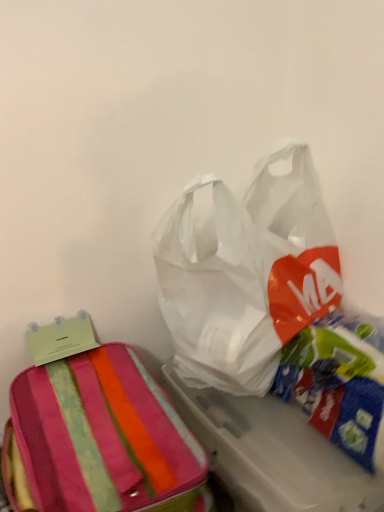
Question: Is transparent plastic bag at upper right looking in the opposite direction of striped fabric suitcase at left?

Choices:
 (A) yes
 (B) no

Answer: (B)

Question: Can you confirm if transparent plastic bag at upper right is wider than striped fabric suitcase at left?

Choices:
 (A) yes
 (B) no

Answer: (B)

Question: From the image's perspective, would you say transparent plastic bag at upper right is shown under striped fabric suitcase at left?

Choices:
 (A) yes
 (B) no

Answer: (B)

Question: From a real-world perspective, is transparent plastic bag at upper right physically below striped fabric suitcase at left?

Choices:
 (A) no
 (B) yes

Answer: (A)

Question: From the image's perspective, is transparent plastic bag at upper right on top of striped fabric suitcase at left?

Choices:
 (A) yes
 (B) no

Answer: (A)

Question: Does transparent plastic bag at upper right have a smaller size compared to striped fabric suitcase at left?

Choices:
 (A) no
 (B) yes

Answer: (A)

Question: From a real-world perspective, does striped fabric suitcase at left stand above transparent plastic bag at upper right?

Choices:
 (A) yes
 (B) no

Answer: (B)

Question: Is striped fabric suitcase at left taller than transparent plastic bag at upper right?

Choices:
 (A) no
 (B) yes

Answer: (A)

Question: Is the depth of striped fabric suitcase at left less than that of transparent plastic bag at upper right?

Choices:
 (A) no
 (B) yes

Answer: (B)

Question: Can you confirm if striped fabric suitcase at left is smaller than transparent plastic bag at upper right?

Choices:
 (A) yes
 (B) no

Answer: (A)

Question: From a real-world perspective, is striped fabric suitcase at left under transparent plastic bag at upper right?

Choices:
 (A) yes
 (B) no

Answer: (A)

Question: From the image's perspective, would you say striped fabric suitcase at left is positioned over transparent plastic bag at upper right?

Choices:
 (A) yes
 (B) no

Answer: (B)

Question: Would you say striped fabric suitcase at left is to the left or to the right of transparent plastic bag at upper right in the picture?

Choices:
 (A) right
 (B) left

Answer: (B)